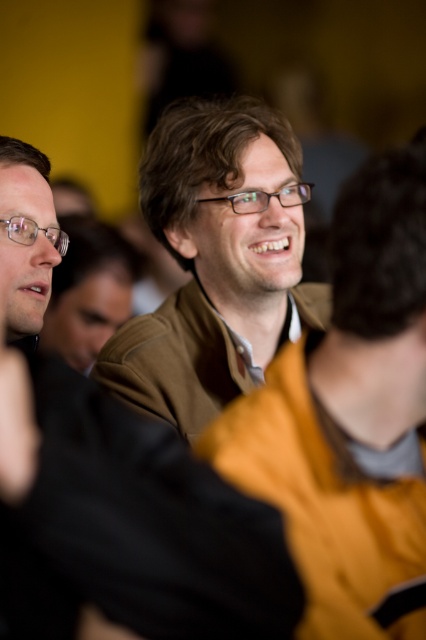
Question: Which object is the closest to the matte brown jacket at center?

Choices:
 (A) brown leather jacket at center
 (B) brown matte jacket at center

Answer: (A)

Question: Can you confirm if brown matte jacket at center is smaller than matte brown jacket at center?

Choices:
 (A) no
 (B) yes

Answer: (B)

Question: Which object appears closest to the camera in this image?

Choices:
 (A) brown leather jacket at center
 (B) matte brown jacket at center
 (C) brown matte jacket at center

Answer: (C)

Question: Observing the image, what is the correct spatial positioning of brown leather jacket at center in reference to matte brown jacket at center?

Choices:
 (A) right
 (B) left

Answer: (A)

Question: Can you confirm if brown matte jacket at center is thinner than brown leather jacket at center?

Choices:
 (A) yes
 (B) no

Answer: (A)

Question: Which object is farther from the camera taking this photo?

Choices:
 (A) brown matte jacket at center
 (B) matte brown jacket at center

Answer: (B)